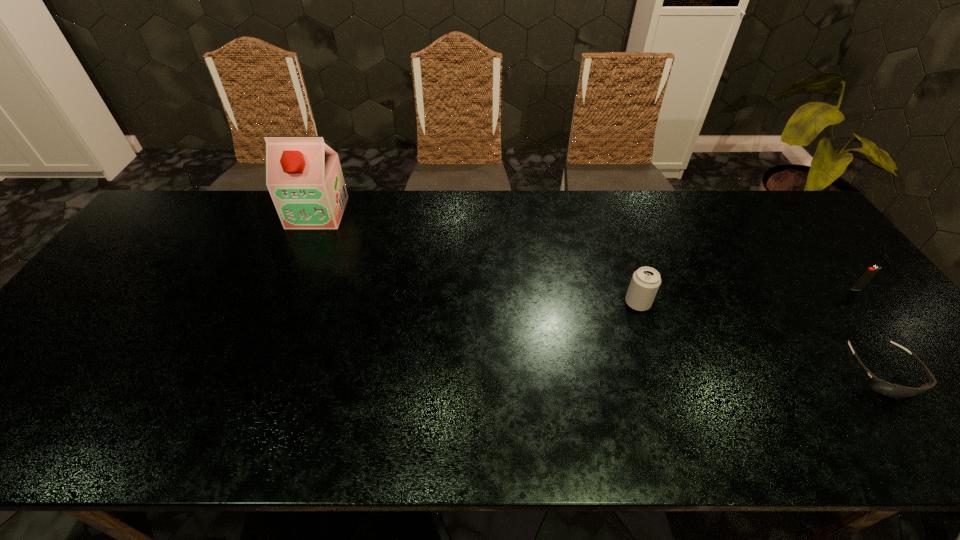
Locate an element on the screen. This screenshot has width=960, height=540. soya milk is located at coordinates (303, 175).

This screenshot has height=540, width=960. Find the location of `the tallest object`. the tallest object is located at coordinates (303, 175).

Where is `the second object from left to right`? The height and width of the screenshot is (540, 960). the second object from left to right is located at coordinates (645, 282).

This screenshot has width=960, height=540. What are the coordinates of `the second nearest object` in the screenshot? It's located at (645, 282).

I want to click on the third tallest object, so click(871, 272).

You are a GUI agent. You are given a task and a screenshot of the screen. Output one action in this format:
    pyautogui.click(x=<x>, y=<y>)
    Task: Click on the rightmost object
    The width and height of the screenshot is (960, 540).
    Given the screenshot: What is the action you would take?
    pyautogui.click(x=871, y=272)

Where is `the second object from right to left`? the second object from right to left is located at coordinates (892, 390).

Image resolution: width=960 pixels, height=540 pixels. In order to click on the nearest object in this screenshot , I will do `click(892, 390)`.

Where is `vacant region located with the cap open on the farthest object`? The width and height of the screenshot is (960, 540). vacant region located with the cap open on the farthest object is located at coordinates (292, 274).

Locate an element on the screen. The width and height of the screenshot is (960, 540). vacant area situated on the front of the third shortest object is located at coordinates (678, 426).